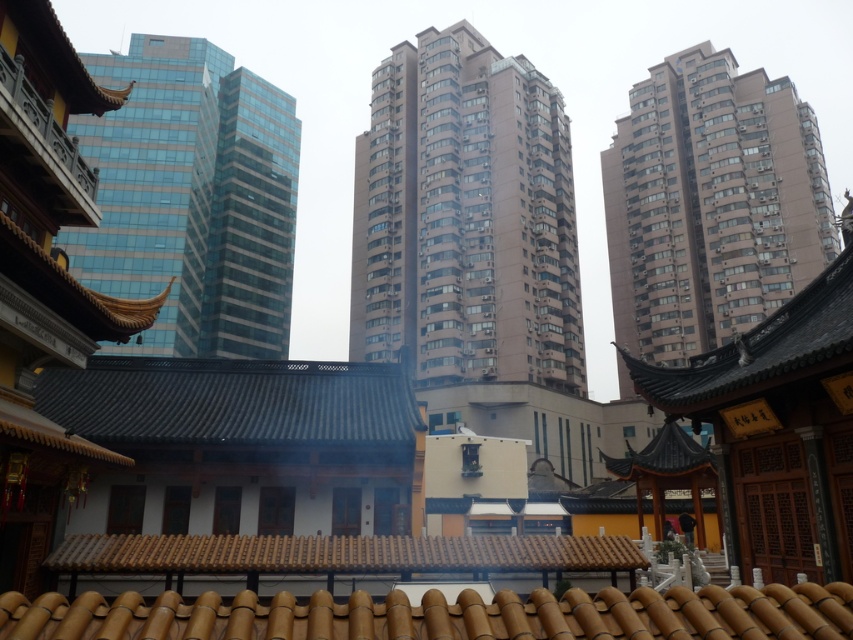
Who is more distant from viewer, (492, 284) or (799, 112)?

The point (799, 112) is more distant.

Is point (514, 298) less distant than point (730, 51)?

Yes.

Find the location of a particular element. The width and height of the screenshot is (853, 640). beige concrete building at center is located at coordinates (465, 218).

Does beige concrete building at center have a lesser width compared to blue glass building at left?

In fact, beige concrete building at center might be wider than blue glass building at left.

Between beige concrete building at center and blue glass building at left, which one has more height?

Standing taller between the two is beige concrete building at center.

You are a GUI agent. You are given a task and a screenshot of the screen. Output one action in this format:
    pyautogui.click(x=<x>, y=<y>)
    Task: Click on the beige concrete building at center
    This screenshot has width=853, height=640.
    Given the screenshot: What is the action you would take?
    pyautogui.click(x=465, y=218)

Which is more to the right, blue glass building at left or brown textured building at upper right?

brown textured building at upper right

Does blue glass building at left have a greater height compared to brown textured building at upper right?

No.

Between point (171, 157) and point (682, 80), which one is positioned in front?

Point (171, 157) is in front.

Where is `blue glass building at left`? blue glass building at left is located at coordinates (194, 196).